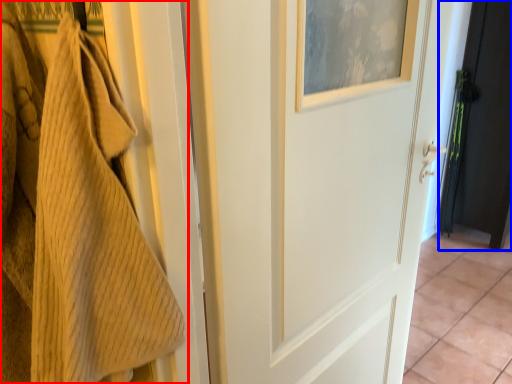
Question: Which object is closer to the camera taking this photo, towel (highlighted by a red box) or door (highlighted by a blue box)?

Choices:
 (A) towel
 (B) door

Answer: (A)